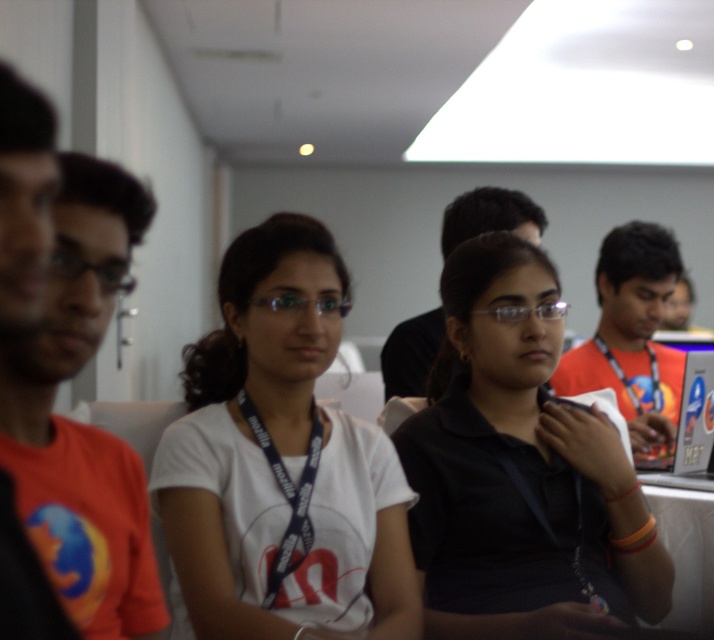
You are standing in the conference room and want to reach a specific point to place a small object. The point is located at coordinates point (26, 513). Given that you need to place the object at exactly this point, which is 1.29 meters away from your current position, can you confirm if this distance is feasible for placing the object without moving closer?

The distance of point (26, 513) from camera is 1.29 meters, so yes, you can place the object at exactly this point without needing to move closer since the distance is already 1.29 meters.

You are a photographer in the room and want to capture a photo of both the black matte shirt at center and the orange fabric shirt at left. However, you need to ensure that neither of them is blocking the other in the photo. Based on their positions, which shirt should be moved forward so that both are visible?

The orange fabric shirt at left is behind the black matte shirt at center, so moving the orange fabric shirt at left forward would allow both shirts to be visible without obstruction.